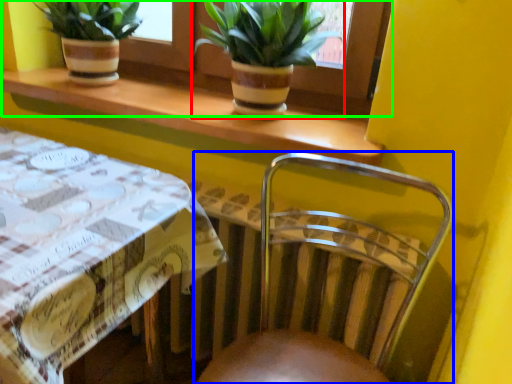
Question: Which object is the farthest from houseplant (highlighted by a red box)? Choose among these: chair (highlighted by a blue box) or window frame (highlighted by a green box).

Choices:
 (A) chair
 (B) window frame

Answer: (A)